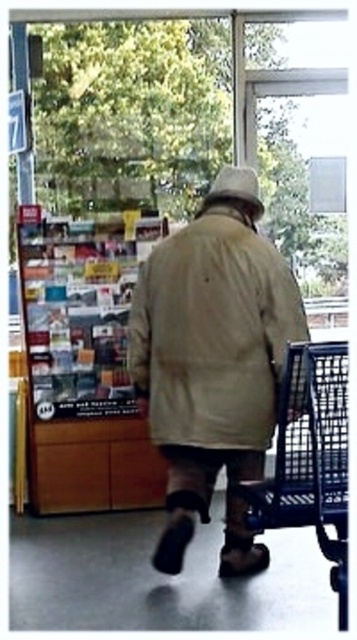
Question: Estimate the real-world distances between objects in this image. Which object is farther from the khaki cotton jacket at center?

Choices:
 (A) metallic blue shopping cart at right
 (B) white fabric hat at upper center

Answer: (B)

Question: Is khaki cotton jacket at center to the right of white fabric hat at upper center from the viewer's perspective?

Choices:
 (A) no
 (B) yes

Answer: (A)

Question: Considering the real-world distances, which object is farthest from the khaki cotton jacket at center?

Choices:
 (A) white fabric hat at upper center
 (B) metallic blue shopping cart at right

Answer: (A)

Question: Is metallic blue shopping cart at right closer to the viewer compared to white fabric hat at upper center?

Choices:
 (A) yes
 (B) no

Answer: (A)

Question: Which point is closer to the camera taking this photo?

Choices:
 (A) (289, 428)
 (B) (260, 202)
 (C) (172, 288)

Answer: (A)

Question: Does khaki cotton jacket at center have a larger size compared to metallic blue shopping cart at right?

Choices:
 (A) no
 (B) yes

Answer: (B)